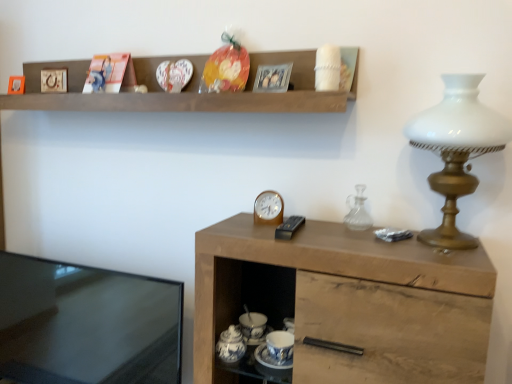
Question: Is black glossy tv at left far away from wooden shelf at upper center?

Choices:
 (A) no
 (B) yes

Answer: (A)

Question: From the image's perspective, is black glossy tv at left above wooden shelf at upper center?

Choices:
 (A) no
 (B) yes

Answer: (A)

Question: From a real-world perspective, does black glossy tv at left stand above wooden shelf at upper center?

Choices:
 (A) yes
 (B) no

Answer: (B)

Question: Can you confirm if black glossy tv at left is smaller than wooden shelf at upper center?

Choices:
 (A) yes
 (B) no

Answer: (B)

Question: Does black glossy tv at left appear on the right side of wooden shelf at upper center?

Choices:
 (A) no
 (B) yes

Answer: (A)

Question: Can you confirm if black glossy tv at left is positioned to the left of wooden shelf at upper center?

Choices:
 (A) yes
 (B) no

Answer: (A)

Question: Does wooden shelf at upper center lie in front of matte wooden picture frame at upper left, arranged as the third picture frame when viewed from the right?

Choices:
 (A) no
 (B) yes

Answer: (B)

Question: Considering the relative sizes of wooden shelf at upper center and matte wooden picture frame at upper left, arranged as the third picture frame when viewed from the right, in the image provided, is wooden shelf at upper center wider than matte wooden picture frame at upper left, arranged as the third picture frame when viewed from the right,?

Choices:
 (A) yes
 (B) no

Answer: (A)

Question: From the image's perspective, is wooden shelf at upper center below matte wooden picture frame at upper left, acting as the first picture frame starting from the back?

Choices:
 (A) no
 (B) yes

Answer: (B)

Question: Considering the relative sizes of wooden shelf at upper center and matte wooden picture frame at upper left, arranged as the third picture frame when viewed from the right, in the image provided, is wooden shelf at upper center taller than matte wooden picture frame at upper left, arranged as the third picture frame when viewed from the right,?

Choices:
 (A) no
 (B) yes

Answer: (B)

Question: Can you confirm if wooden shelf at upper center is bigger than matte wooden picture frame at upper left, marked as the third picture frame in a front-to-back arrangement?

Choices:
 (A) yes
 (B) no

Answer: (A)

Question: Is wooden shelf at upper center outside matte wooden picture frame at upper left, acting as the first picture frame starting from the back?

Choices:
 (A) no
 (B) yes

Answer: (B)

Question: Does wooden picture frame at upper left, which ranks as the 2th picture frame in back-to-front order, have a greater width compared to transparent glass carafe at right?

Choices:
 (A) no
 (B) yes

Answer: (A)